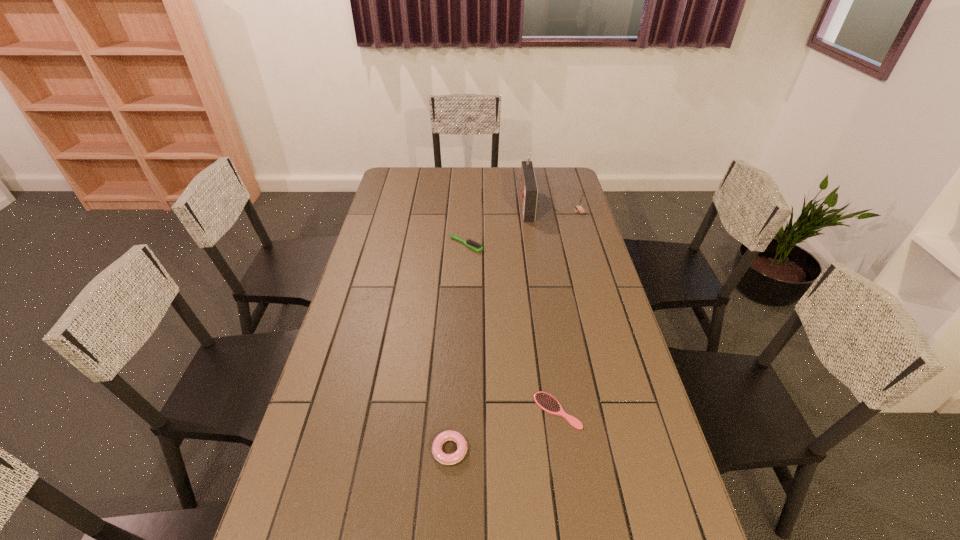
In order to click on blank space at the far left corner of the desktop in this screenshot , I will do `click(408, 180)`.

What are the coordinates of `empty space between the farther hairbrush and the rightmost object` in the screenshot? It's located at (523, 228).

I want to click on free spot between the tallest object and the nearest object, so click(488, 327).

Identify the location of empty location between the doughnut and the tallest object. This screenshot has height=540, width=960. (488, 327).

At what (x,y) coordinates should I click in order to perform the action: click on vacant area that lies between the nearest object and the fourth farthest object. Please return your answer as a coordinate pair (x, y). The width and height of the screenshot is (960, 540). Looking at the image, I should click on (504, 430).

At what (x,y) coordinates should I click in order to perform the action: click on blank region between the matchbox and the radio receiver. Please return your answer as a coordinate pair (x, y). Looking at the image, I should click on (553, 208).

Where is `free space that is in between the taller hairbrush and the doughnut`? free space that is in between the taller hairbrush and the doughnut is located at coordinates (458, 347).

Locate an element on the screen. The image size is (960, 540). unoccupied position between the fourth shortest object and the right hairbrush is located at coordinates (568, 310).

This screenshot has width=960, height=540. I want to click on vacant point located between the doughnut and the right hairbrush, so click(504, 430).

This screenshot has height=540, width=960. I want to click on free space between the doughnut and the matchbox, so click(515, 330).